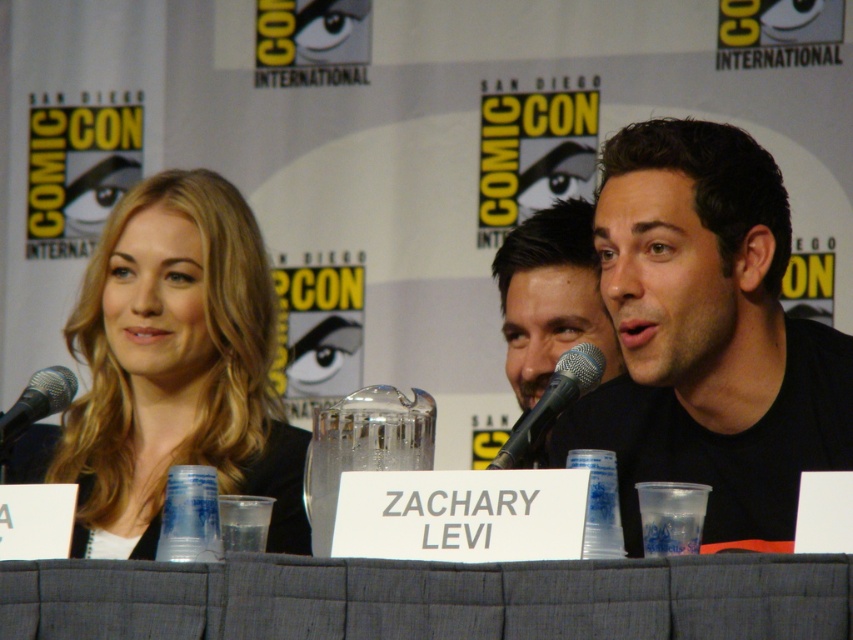
In the scene shown: Who is lower down, black matte shirt at center or smooth black shirt at center?

black matte shirt at center is below.

Who is more forward, (822,420) or (592,205)?

Positioned in front is point (822,420).

Between point (627, 314) and point (544, 248), which one is positioned in front?

Point (627, 314) is more forward.

Where is `black matte shirt at center`? The height and width of the screenshot is (640, 853). black matte shirt at center is located at coordinates (708, 337).

Measure the distance between point (560, 442) and camera.

Point (560, 442) is 3.65 meters away from camera.

Does black matte shirt at center have a greater height compared to black metallic microphone at center?

Indeed, black matte shirt at center has a greater height compared to black metallic microphone at center.

Locate an element on the screen. The image size is (853, 640). black matte shirt at center is located at coordinates (708, 337).

Find the location of a particular element. Image resolution: width=853 pixels, height=640 pixels. black matte shirt at center is located at coordinates (708, 337).

Which is below, smooth black shirt at center or black metallic microphone at center?

black metallic microphone at center is below.

The image size is (853, 640). Describe the element at coordinates (550, 298) in the screenshot. I see `smooth black shirt at center` at that location.

Which is behind, point (541, 372) or point (534, 413)?

The point (541, 372) is behind.

I want to click on smooth black shirt at center, so click(x=550, y=298).